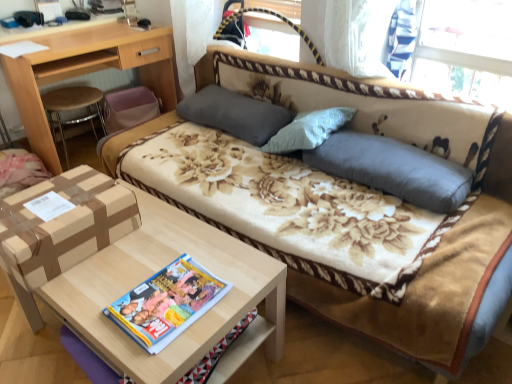
Locate an element on the screen. The height and width of the screenshot is (384, 512). vacant area in front of multicolored glossy magazine at center is located at coordinates (158, 353).